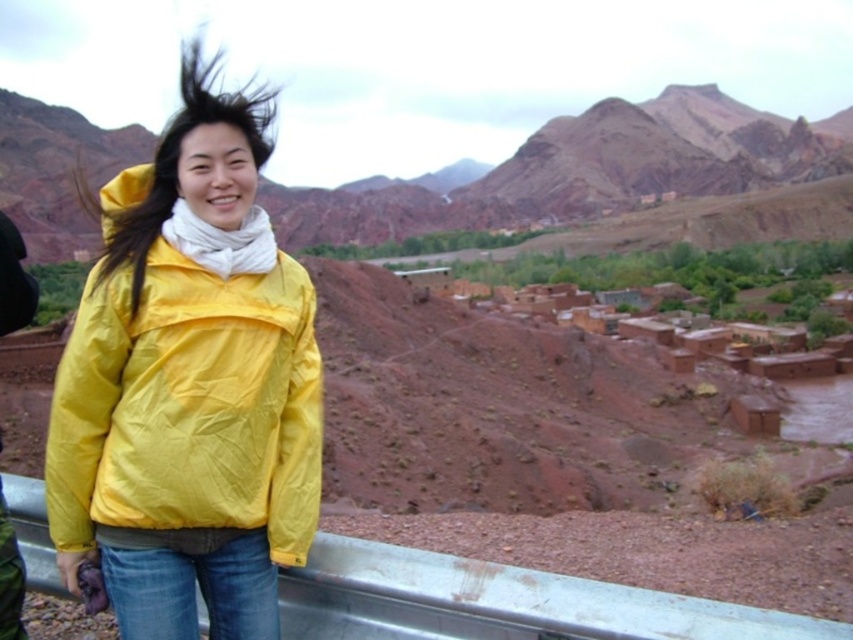
You are a photographer trying to capture the best shot of the person in the bright yellow jacket and the rugged mountains. You notice two points marked in the scene. Which point is closer to your camera lens, point 1 at coordinates point (47, 147) or point 2 at coordinates point (93, 285)?

Point 2 at coordinates point (93, 285) is closer to the camera lens because the description states that point (47, 147) is further away than point (93, 285).

You are a photographer planning to take a portrait of the person in the scene. The person is standing in front of the matte brown rock at upper center and has their dark brown silky hair at center blowing in the wind. To ensure the rock is clearly visible in the background, should you adjust the camera focus to prioritize the rock or the hair?

The matte brown rock at upper center is wider than the dark brown silky hair at center, so focusing on the rock would ensure it remains clearly visible in the background while the hair might naturally blur due to its smaller size and movement.